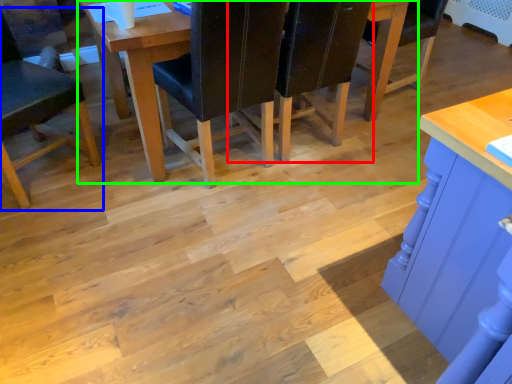
Question: Which is nearer to the chair (highlighted by a red box)? chair (highlighted by a blue box) or table (highlighted by a green box).

Choices:
 (A) chair
 (B) table

Answer: (B)